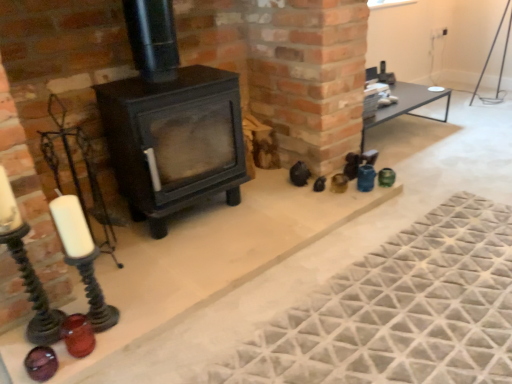
The width and height of the screenshot is (512, 384). I want to click on vacant area that is in front of matte black wood burning stove at center, so click(176, 268).